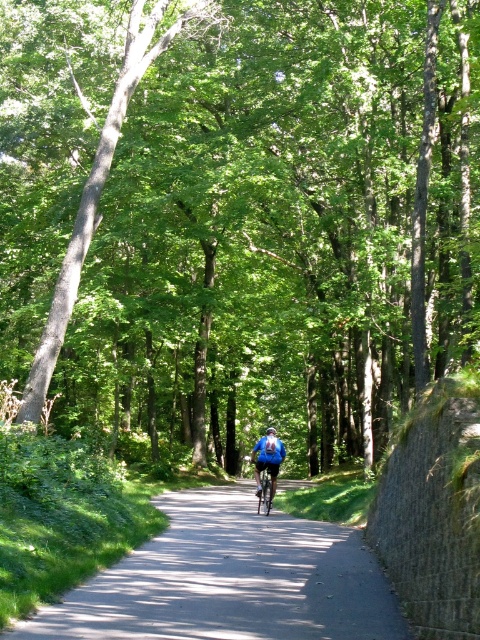
Question: Among these objects, which one is nearest to the camera?

Choices:
 (A) blue matte helmet at center
 (B) blue fabric jacket at center
 (C) green leafy tree at center

Answer: (C)

Question: Which of the following is the closest to the observer?

Choices:
 (A) blue matte helmet at center
 (B) smooth asphalt path at center
 (C) blue fabric jacket at center

Answer: (B)

Question: Where is smooth asphalt path at center located in relation to blue fabric jacket at center in the image?

Choices:
 (A) above
 (B) below

Answer: (A)

Question: Which object is positioned closest to the blue fabric jacket at center?

Choices:
 (A) green leafy tree at center
 (B) blue matte helmet at center
 (C) smooth asphalt path at center

Answer: (B)

Question: Does blue fabric jacket at center have a greater width compared to blue matte helmet at center?

Choices:
 (A) no
 (B) yes

Answer: (A)

Question: Can you confirm if green leafy tree at center is positioned to the right of blue fabric jacket at center?

Choices:
 (A) no
 (B) yes

Answer: (A)